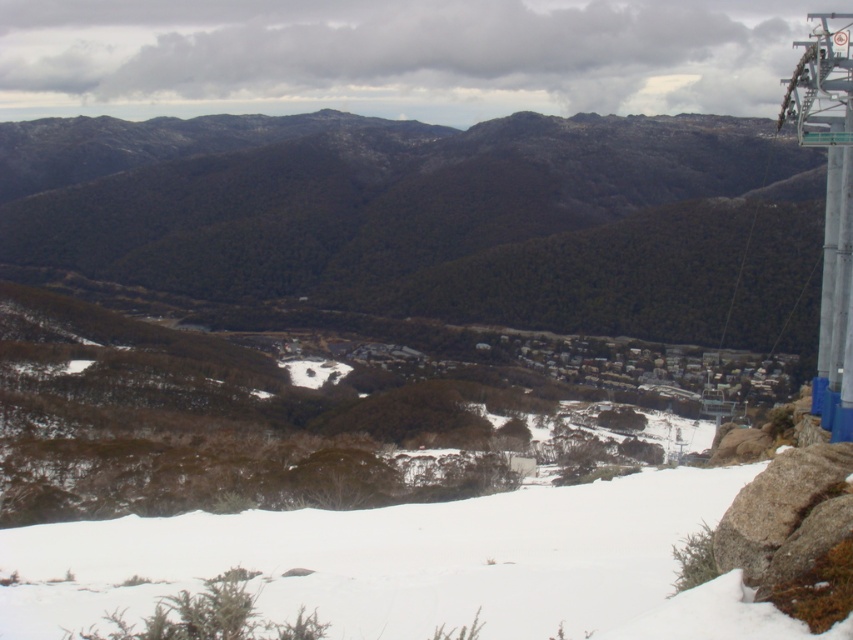
Question: Considering the relative positions of green matte mountain at center and white snow at lower center in the image provided, where is green matte mountain at center located with respect to white snow at lower center?

Choices:
 (A) below
 (B) above

Answer: (B)

Question: In this image, where is green matte mountain at center located relative to white snow at lower center?

Choices:
 (A) below
 (B) above

Answer: (B)

Question: Which of the following is the closest to the observer?

Choices:
 (A) (651, 124)
 (B) (614, 556)

Answer: (B)

Question: Is green matte mountain at center behind white snow at lower center?

Choices:
 (A) no
 (B) yes

Answer: (B)

Question: Which object appears closest to the camera in this image?

Choices:
 (A) white snow at lower center
 (B) green matte mountain at center

Answer: (A)